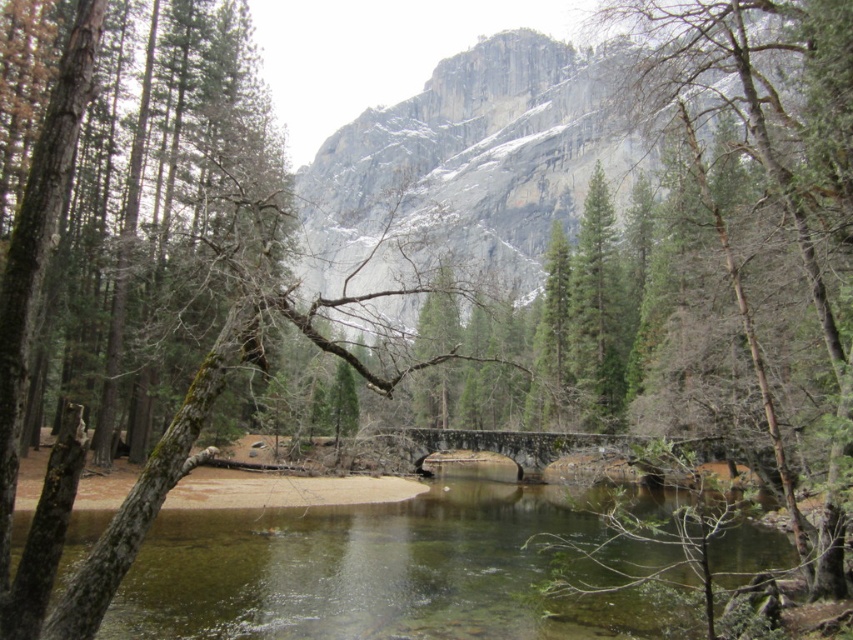
You are standing on the stone bridge and looking towards the green mossy tree trunk at center and the green matte tree at center. Which tree is closer to you?

The green matte tree at center is closer to you because it is positioned further to the viewer than the green mossy tree trunk at center, meaning it appears nearer in the scene.

You are standing at the edge of the river and want to cross to the other side. The green matte tree at center and the green mossy tree trunk at center are blocking your path. Which obstacle is narrower, allowing you to pass through more easily?

The green matte tree at center has a lesser width compared to the green mossy tree trunk at center, so it is narrower and allows easier passage.